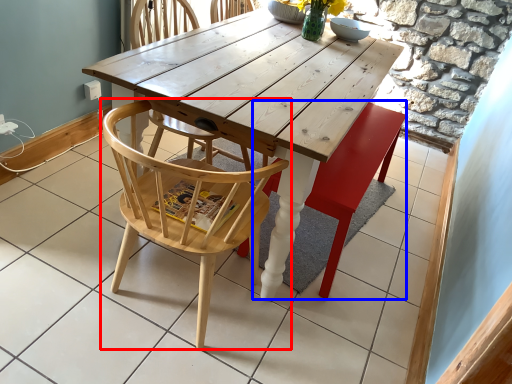
Question: Which point is closer to the camera, chair (highlighted by a red box) or swivel chair (highlighted by a blue box)?

Choices:
 (A) chair
 (B) swivel chair

Answer: (A)